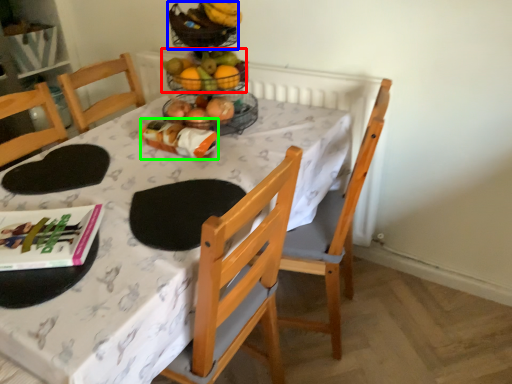
Question: Which object is the farthest from grapefruit (highlighted by a red box)? Choose among these: basket (highlighted by a blue box) or food (highlighted by a green box).

Choices:
 (A) basket
 (B) food

Answer: (B)